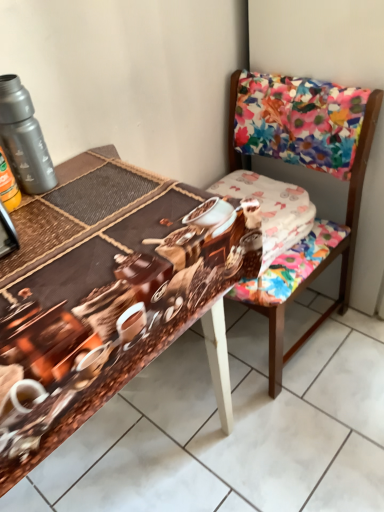
Question: Should I look upward or downward to see metallic gray thermos at upper left?

Choices:
 (A) up
 (B) down

Answer: (A)

Question: Does white cotton fabric at center appear on the left side of metallic gray thermos at upper left?

Choices:
 (A) no
 (B) yes

Answer: (A)

Question: Can you confirm if white cotton fabric at center is bigger than metallic gray thermos at upper left?

Choices:
 (A) no
 (B) yes

Answer: (B)

Question: Does white cotton fabric at center have a smaller size compared to metallic gray thermos at upper left?

Choices:
 (A) yes
 (B) no

Answer: (B)

Question: Considering the relative sizes of white cotton fabric at center and metallic gray thermos at upper left in the image provided, is white cotton fabric at center taller than metallic gray thermos at upper left?

Choices:
 (A) yes
 (B) no

Answer: (B)

Question: Is white cotton fabric at center to the right of metallic gray thermos at upper left from the viewer's perspective?

Choices:
 (A) no
 (B) yes

Answer: (B)

Question: Is metallic gray thermos at upper left inside white cotton fabric at center?

Choices:
 (A) no
 (B) yes

Answer: (A)

Question: Could you tell me if metallic gray thermos at upper left is facing brown printed fabric at center?

Choices:
 (A) yes
 (B) no

Answer: (B)

Question: Does metallic gray thermos at upper left appear on the right side of brown printed fabric at center?

Choices:
 (A) no
 (B) yes

Answer: (A)

Question: From the image's perspective, is metallic gray thermos at upper left below brown printed fabric at center?

Choices:
 (A) yes
 (B) no

Answer: (B)

Question: From a real-world perspective, is metallic gray thermos at upper left located higher than brown printed fabric at center?

Choices:
 (A) no
 (B) yes

Answer: (B)

Question: Is metallic gray thermos at upper left wider than brown printed fabric at center?

Choices:
 (A) yes
 (B) no

Answer: (B)

Question: Does metallic gray thermos at upper left have a smaller size compared to brown printed fabric at center?

Choices:
 (A) yes
 (B) no

Answer: (A)

Question: Is floral fabric chair at upper right smaller than white cotton fabric at center?

Choices:
 (A) yes
 (B) no

Answer: (B)